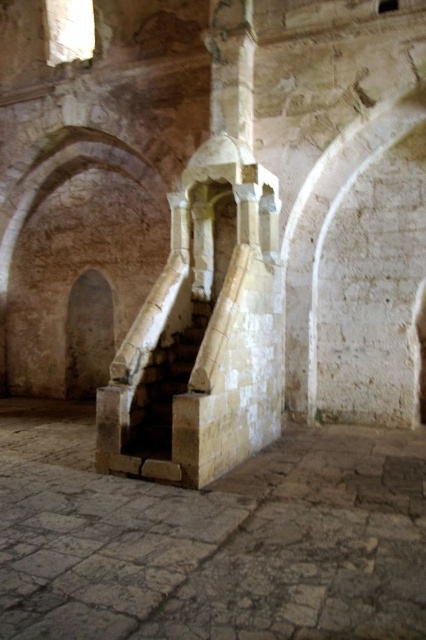
Does stone stairs at center have a greater width compared to stone textured stairs at center?

Yes.

Which is behind, point (144, 484) or point (144, 406)?

The point (144, 406) is more distant.

Is point (383, 548) less distant than point (158, 422)?

Yes, point (383, 548) is in front of point (158, 422).

The image size is (426, 640). What are the coordinates of `stone stairs at center` in the screenshot? It's located at (210, 538).